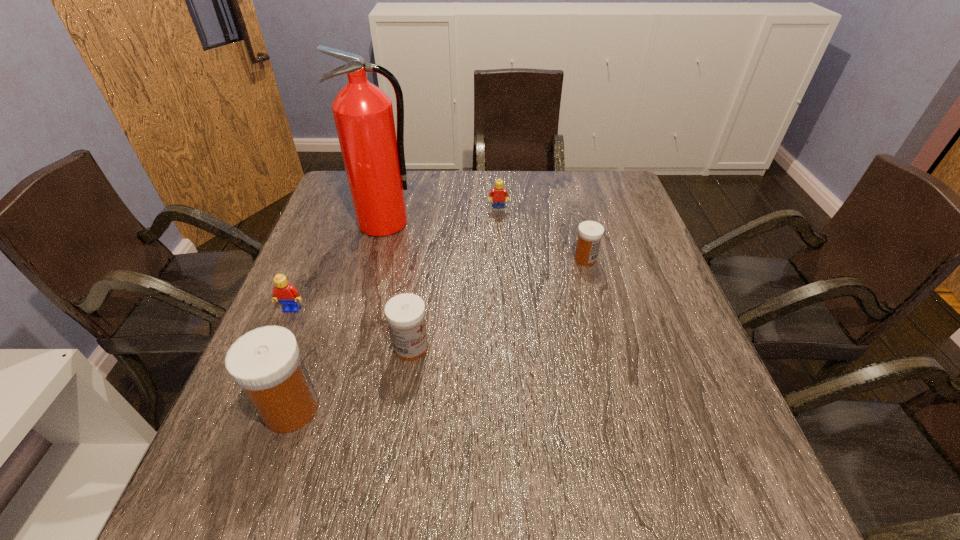
You are a GUI agent. You are given a task and a screenshot of the screen. Output one action in this format:
    pyautogui.click(x=<x>, y=<y>)
    Task: Click on the fourth farthest object
    The width and height of the screenshot is (960, 540).
    Given the screenshot: What is the action you would take?
    pyautogui.click(x=287, y=295)

Find the location of a particular element. This screenshot has width=960, height=540. vacant space located 0.400m on the back of the fifth shortest object is located at coordinates (346, 254).

Image resolution: width=960 pixels, height=540 pixels. In order to click on free region located 0.130m on the left of the second medicine from right to left in this screenshot , I will do `click(332, 348)`.

Find the location of a particular element. vacant region located on the back of the rightmost medicine is located at coordinates pos(576,225).

Locate an element on the screen. Image resolution: width=960 pixels, height=540 pixels. free location located 0.270m on the front-facing side of the right Lego is located at coordinates (502, 275).

Find the location of a particular element. This screenshot has height=540, width=960. free spot located 0.210m at the nozzle of the tallest object is located at coordinates (367, 292).

Identify the location of vacant space situated on the front-facing side of the left Lego. This screenshot has height=540, width=960. (233, 448).

This screenshot has height=540, width=960. What are the coordinates of `Lego at the far edge` in the screenshot? It's located at (498, 194).

Find the location of a particular element. The height and width of the screenshot is (540, 960). fire extinguisher that is at the far edge is located at coordinates (374, 160).

Where is `object that is at the near edge`? This screenshot has height=540, width=960. object that is at the near edge is located at coordinates (266, 362).